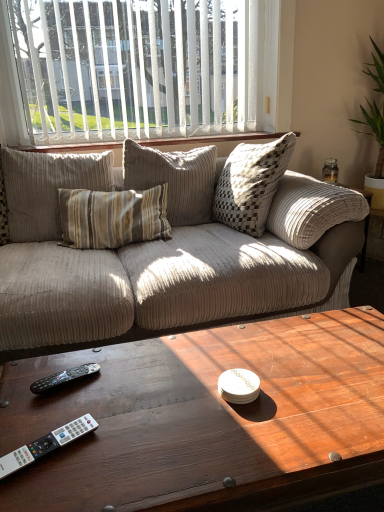
Question: From the image's perspective, is beige corduroy pillow at center under white plastic remote control at lower left, marked as the 1th remote control in a front-to-back arrangement?

Choices:
 (A) no
 (B) yes

Answer: (A)

Question: From a real-world perspective, is beige corduroy pillow at center beneath white plastic remote control at lower left, marked as the 1th remote control in a front-to-back arrangement?

Choices:
 (A) yes
 (B) no

Answer: (B)

Question: Is beige corduroy pillow at center in contact with white plastic remote control at lower left, marked as the 1th remote control in a front-to-back arrangement?

Choices:
 (A) no
 (B) yes

Answer: (A)

Question: Is beige corduroy pillow at center further to camera compared to white plastic remote control at lower left, marked as the 1th remote control in a front-to-back arrangement?

Choices:
 (A) yes
 (B) no

Answer: (A)

Question: Is white plastic remote control at lower left, marked as the 1th remote control in a front-to-back arrangement, inside beige corduroy pillow at center?

Choices:
 (A) yes
 (B) no

Answer: (B)

Question: From a real-world perspective, is wooden coffee table at center positioned above or below wooden at upper center?

Choices:
 (A) above
 (B) below

Answer: (B)

Question: Is wooden coffee table at center bigger or smaller than wooden at upper center?

Choices:
 (A) big
 (B) small

Answer: (A)

Question: In the image, is wooden coffee table at center on the left side or the right side of wooden at upper center?

Choices:
 (A) left
 (B) right

Answer: (B)

Question: In terms of height, does wooden coffee table at center look taller or shorter compared to wooden at upper center?

Choices:
 (A) short
 (B) tall

Answer: (B)

Question: Is point (71, 175) closer or farther from the camera than point (163, 148)?

Choices:
 (A) farther
 (B) closer

Answer: (B)

Question: From their relative heights in the image, would you say beige corduroy pillow at center is taller or shorter than wooden at upper center?

Choices:
 (A) tall
 (B) short

Answer: (A)

Question: From the image's perspective, is beige corduroy pillow at center positioned above or below wooden at upper center?

Choices:
 (A) below
 (B) above

Answer: (A)

Question: From a real-world perspective, is beige corduroy pillow at center physically located above or below wooden at upper center?

Choices:
 (A) below
 (B) above

Answer: (A)

Question: In the image, is white vertical blinds at upper center positioned in front of or behind wooden at upper center?

Choices:
 (A) behind
 (B) front

Answer: (B)

Question: From a real-world perspective, is white vertical blinds at upper center above or below wooden at upper center?

Choices:
 (A) above
 (B) below

Answer: (A)